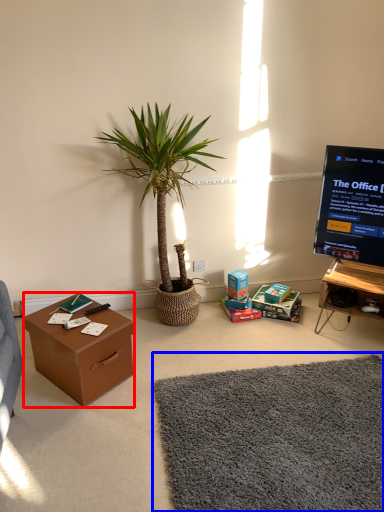
Question: Among these objects, which one is farthest to the camera, desk (highlighted by a red box) or plain (highlighted by a blue box)?

Choices:
 (A) desk
 (B) plain

Answer: (A)